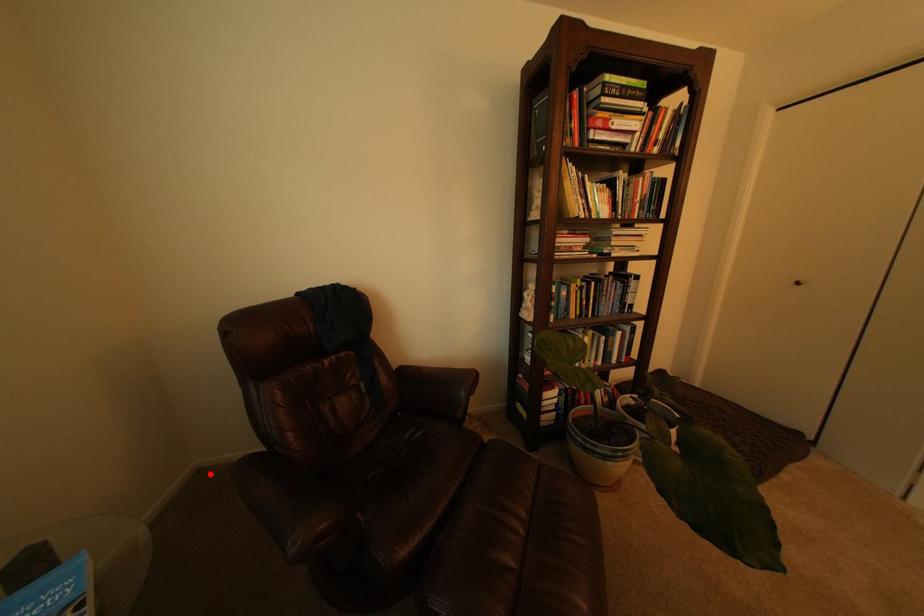
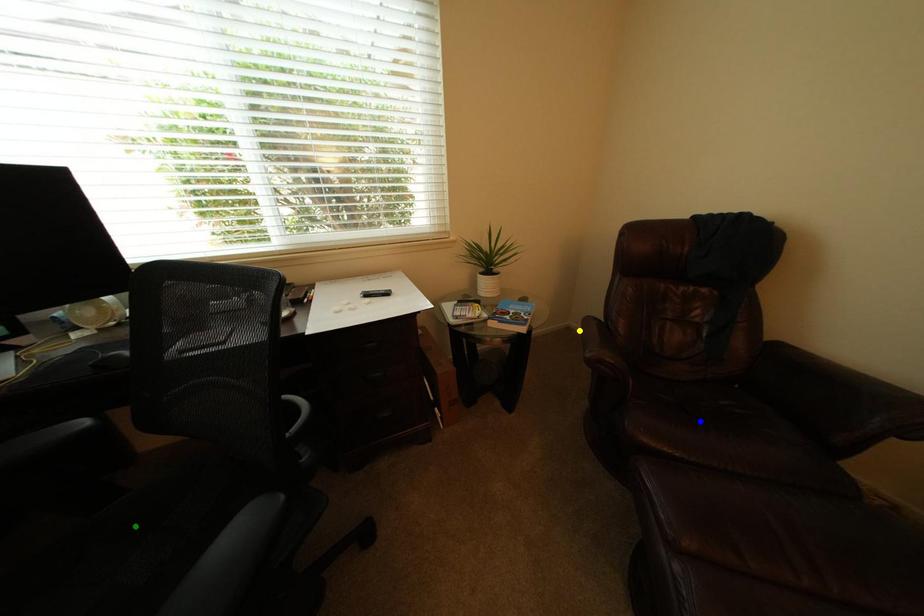
Question: I am providing you with two images of the same scene from different viewpoints. A red point is marked on the first image. You are given multiple points on the second image. Can you choose the point in image 2 that corresponds to the point in image 1?

Choices:
 (A) blue point
 (B) green point
 (C) yellow point

Answer: (C)